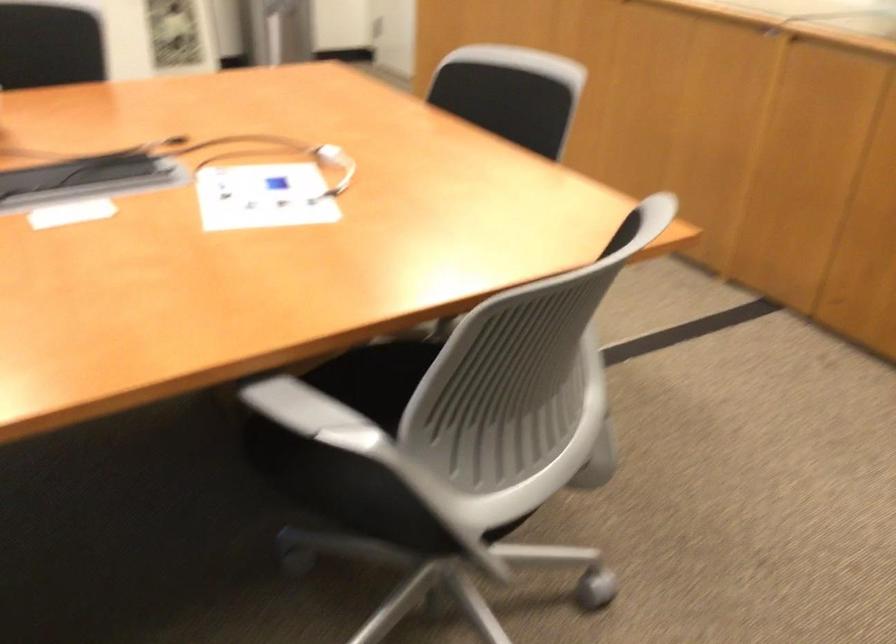
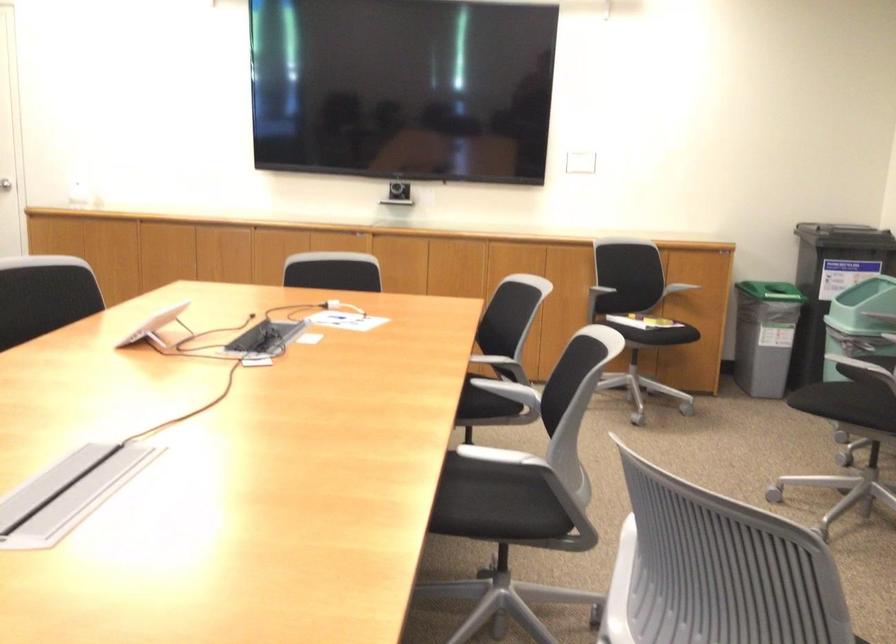
The point at (531, 104) is marked in the first image. Where is the corresponding point in the second image?

(332, 272)